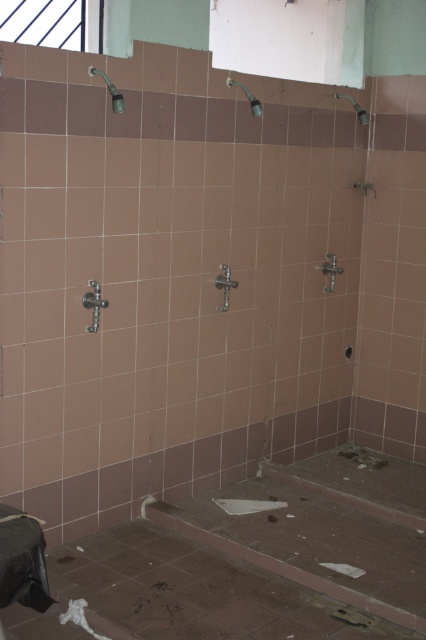
Does point (89, 68) come farther from viewer compared to point (342, 96)?

No, it is not.

Is matte silver shower head at upper left below matte silver shower head at upper right?

Correct, matte silver shower head at upper left is located below matte silver shower head at upper right.

Locate an element on the screen. The height and width of the screenshot is (640, 426). matte silver shower head at upper left is located at coordinates (109, 90).

Based on the photo, who is shorter, metallic silver shower at center or metallic silver faucet at upper center?

Standing shorter between the two is metallic silver faucet at upper center.

Can you confirm if metallic silver shower at center is shorter than metallic silver faucet at upper center?

In fact, metallic silver shower at center may be taller than metallic silver faucet at upper center.

Based on the photo, who is more forward, (224, 273) or (250, 100)?

Positioned in front is point (250, 100).

Identify the location of metallic silver shower at center. This screenshot has height=640, width=426. click(224, 285).

Can you confirm if metallic silver faucet at upper center is taller than matte silver shower head at upper right?

Yes, metallic silver faucet at upper center is taller than matte silver shower head at upper right.

Is point (253, 104) closer to camera compared to point (354, 100)?

Yes, point (253, 104) is in front of point (354, 100).

The width and height of the screenshot is (426, 640). What do you see at coordinates (247, 97) in the screenshot?
I see `metallic silver faucet at upper center` at bounding box center [247, 97].

Image resolution: width=426 pixels, height=640 pixels. Identify the location of metallic silver faucet at upper center. (247, 97).